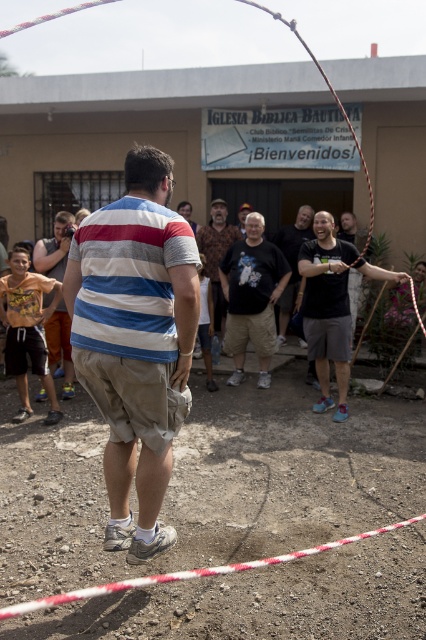
You are a photographer at the event and want to take a photo of the black matte shirt at center and the rope at center. Which object will appear larger in the photo?

The black matte shirt at center will appear larger in the photo because it is closer to the viewer than the rope at center.